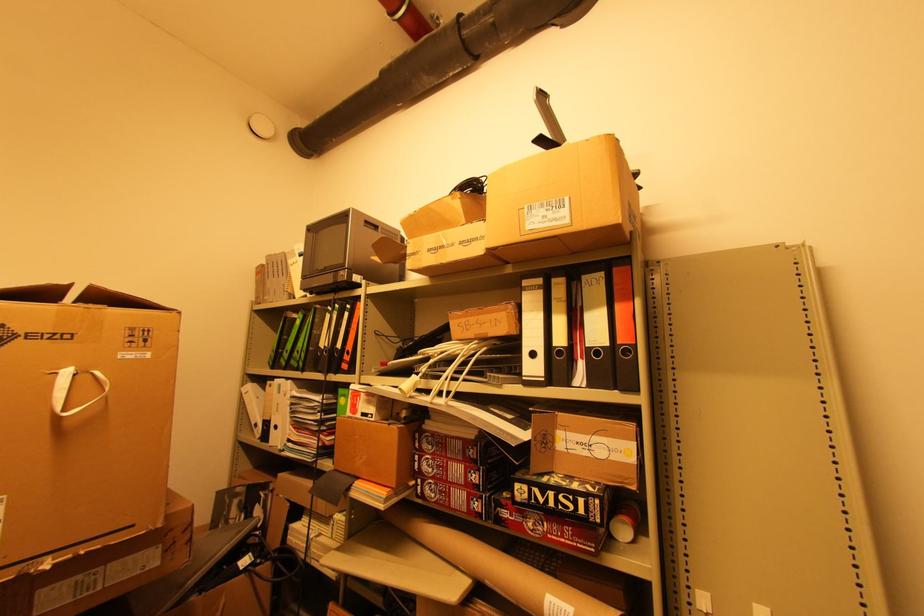
Where is `large cardboard box`? The image size is (924, 616). large cardboard box is located at coordinates (81, 419).